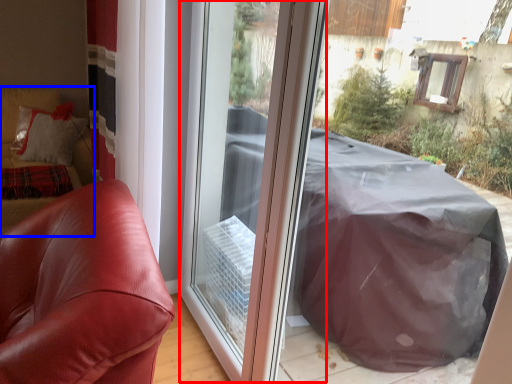
Question: Which object is further to the camera taking this photo, screen door (highlighted by a red box) or couch (highlighted by a blue box)?

Choices:
 (A) screen door
 (B) couch

Answer: (B)